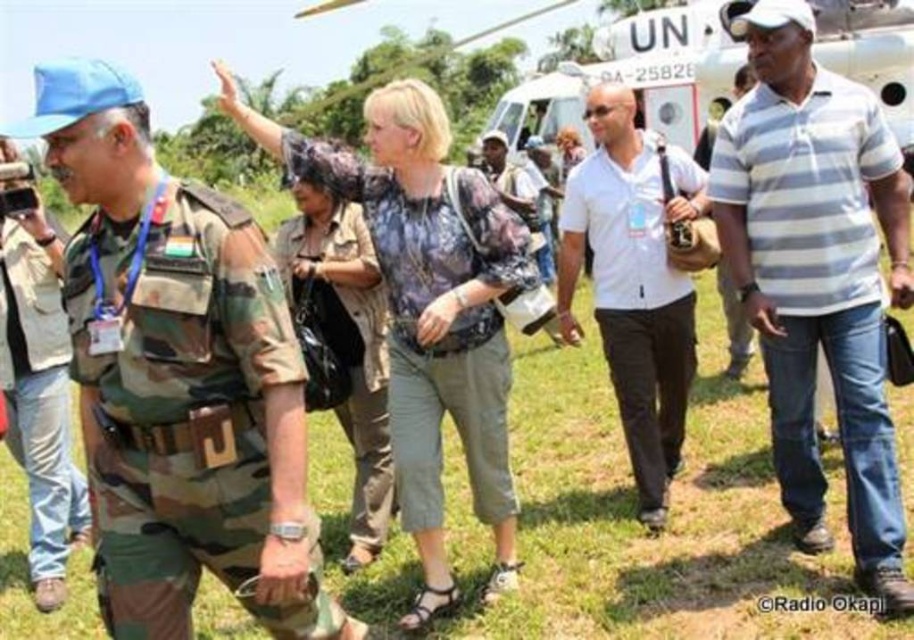
Question: Does white striped polo shirt at center appear on the right side of camouflage fabric uniform at center?

Choices:
 (A) yes
 (B) no

Answer: (A)

Question: Is white striped polo shirt at center in front of camouflage uniform at center?

Choices:
 (A) no
 (B) yes

Answer: (B)

Question: Which of the following is the farthest from the observer?

Choices:
 (A) camouflage fabric uniform at center
 (B) white striped polo shirt at center
 (C) white matte helicopter at upper center
 (D) white cotton polo shirt at center

Answer: (D)

Question: Which object is farther from the camera taking this photo?

Choices:
 (A) white cotton polo shirt at center
 (B) camouflage fabric uniform at center
 (C) camo uniform at left
 (D) white matte helicopter at upper center

Answer: (A)

Question: Which point is farther to the camera?

Choices:
 (A) camo uniform at left
 (B) white striped polo shirt at center
 (C) camouflage fabric uniform at center

Answer: (C)

Question: Is white striped polo shirt at center further to the viewer compared to white cotton polo shirt at center?

Choices:
 (A) no
 (B) yes

Answer: (A)